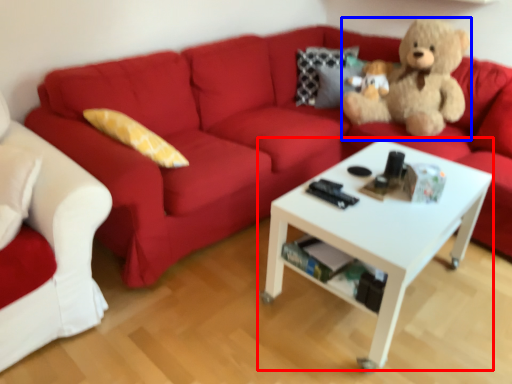
Question: Among these objects, which one is nearest to the camera, coffee table (highlighted by a red box) or teddy bear (highlighted by a blue box)?

Choices:
 (A) coffee table
 (B) teddy bear

Answer: (A)